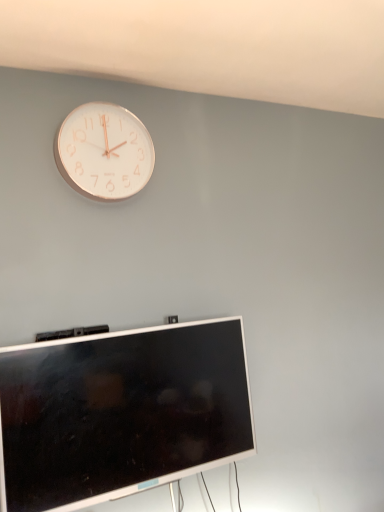
Question: Does silver metallic television at lower center have a greater height compared to white metallic clock at upper left?

Choices:
 (A) no
 (B) yes

Answer: (B)

Question: Is white metallic clock at upper left at the back of silver metallic television at lower center?

Choices:
 (A) no
 (B) yes

Answer: (A)

Question: Is silver metallic television at lower center further to camera compared to white metallic clock at upper left?

Choices:
 (A) no
 (B) yes

Answer: (A)

Question: Considering the relative sizes of silver metallic television at lower center and white metallic clock at upper left in the image provided, is silver metallic television at lower center wider than white metallic clock at upper left?

Choices:
 (A) yes
 (B) no

Answer: (A)

Question: Is silver metallic television at lower center completely or partially outside of white metallic clock at upper left?

Choices:
 (A) yes
 (B) no

Answer: (A)

Question: Would you consider silver metallic television at lower center to be distant from white metallic clock at upper left?

Choices:
 (A) yes
 (B) no

Answer: (B)

Question: Does white metallic clock at upper left have a greater width compared to silver metallic television at lower center?

Choices:
 (A) yes
 (B) no

Answer: (B)

Question: From the image's perspective, is white metallic clock at upper left above silver metallic television at lower center?

Choices:
 (A) no
 (B) yes

Answer: (B)

Question: From the image's perspective, is white metallic clock at upper left located beneath silver metallic television at lower center?

Choices:
 (A) no
 (B) yes

Answer: (A)

Question: From a real-world perspective, is white metallic clock at upper left located higher than silver metallic television at lower center?

Choices:
 (A) yes
 (B) no

Answer: (A)

Question: Is white metallic clock at upper left to the left of silver metallic television at lower center from the viewer's perspective?

Choices:
 (A) no
 (B) yes

Answer: (B)

Question: Does white metallic clock at upper left have a lesser width compared to silver metallic television at lower center?

Choices:
 (A) no
 (B) yes

Answer: (B)

Question: From a real-world perspective, is white metallic clock at upper left physically located above or below silver metallic television at lower center?

Choices:
 (A) above
 (B) below

Answer: (A)